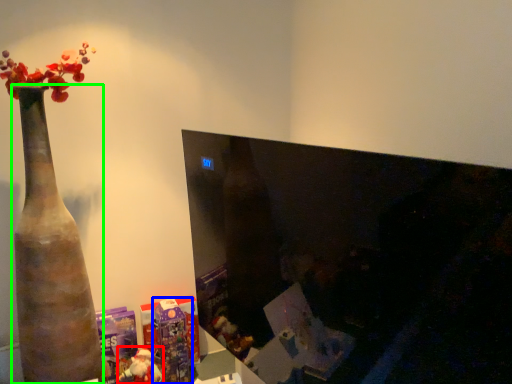
Question: Based on their relative distances, which object is nearer to toy (highlighted by a red box)? Choose from toy (highlighted by a blue box) and vase (highlighted by a green box).

Choices:
 (A) toy
 (B) vase

Answer: (A)